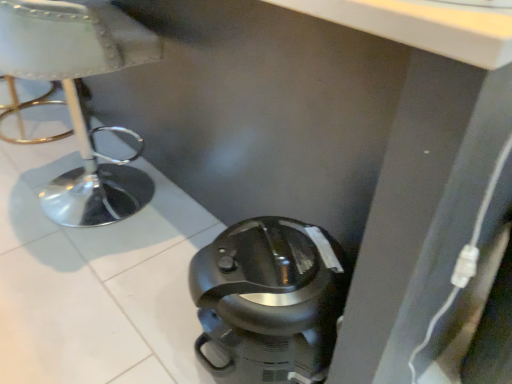
Question: Is black plastic coffee pot at lower center bigger or smaller than white leather stool at left?

Choices:
 (A) big
 (B) small

Answer: (B)

Question: From the image's perspective, is black plastic coffee pot at lower center positioned above or below white leather stool at left?

Choices:
 (A) above
 (B) below

Answer: (B)

Question: Considering the positions of point (286, 258) and point (146, 48), is point (286, 258) closer or farther from the camera than point (146, 48)?

Choices:
 (A) farther
 (B) closer

Answer: (B)

Question: Considering the positions of point (78, 180) and point (285, 235), is point (78, 180) closer or farther from the camera than point (285, 235)?

Choices:
 (A) closer
 (B) farther

Answer: (B)

Question: Is white leather stool at left to the left or to the right of black plastic coffee pot at lower center in the image?

Choices:
 (A) right
 (B) left

Answer: (B)

Question: From the image's perspective, is white leather stool at left above or below black plastic coffee pot at lower center?

Choices:
 (A) above
 (B) below

Answer: (A)

Question: Is white leather stool at left taller or shorter than black plastic coffee pot at lower center?

Choices:
 (A) short
 (B) tall

Answer: (B)